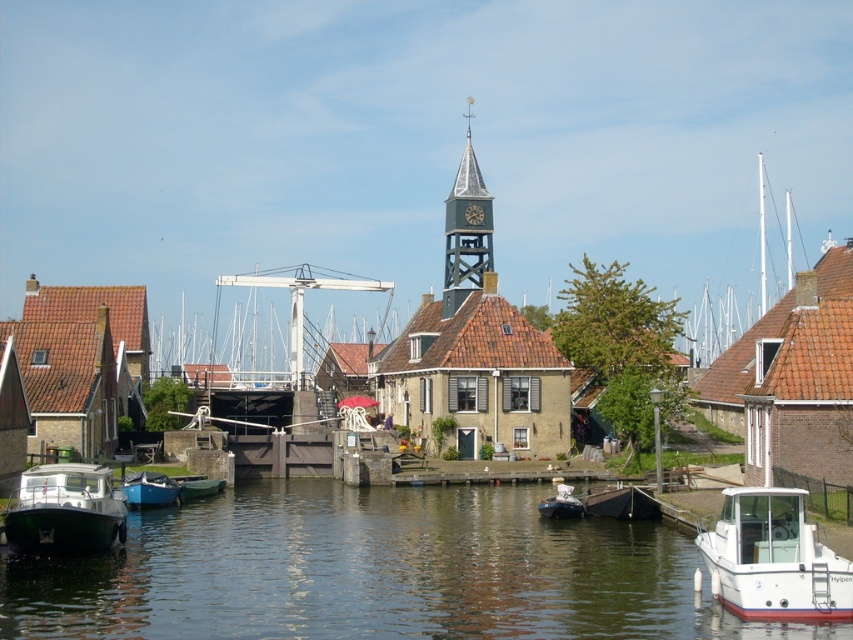
You are standing at the point marked as point (242, 609) in the canal village scene. You want to throw a pebble into the water to see how far it travels. If the pebble can travel 60 meters, will it reach the opposite bank of the canal?

The distance between you and the viewer is 59.39 meters. Since the pebble can travel 60 meters, it will just barely reach the opposite bank of the canal.

You are standing at the point marked as point (375,572) in the image. Based on the scene description, what would you most likely see around you?

You would most likely see greenish water at lower left around you since the point (375,572) corresponds to that location.